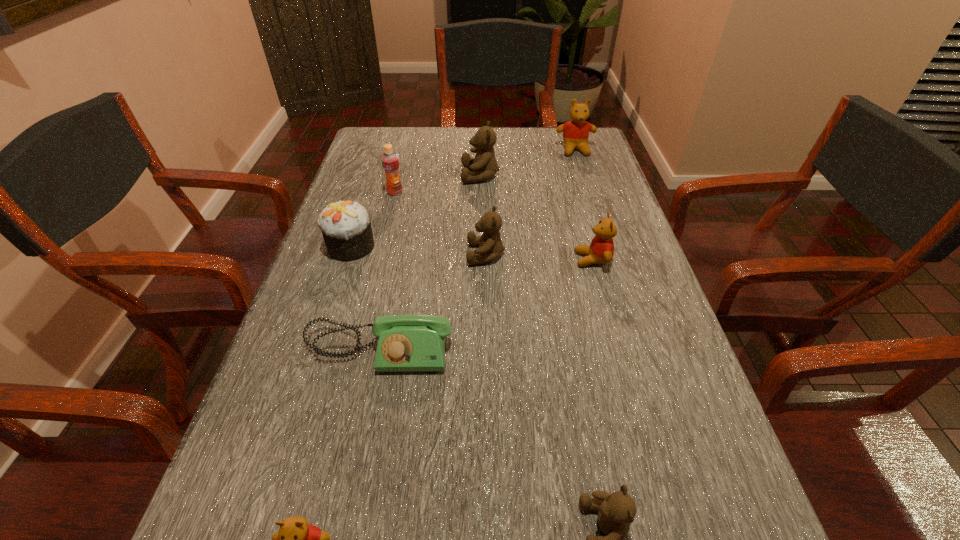
In the image, there is a desktop. Find the location of `blank space at the right edge`. blank space at the right edge is located at coordinates (597, 190).

At what (x,y) coordinates should I click in order to perform the action: click on free space at the far left corner. Please return your answer as a coordinate pair (x, y). Looking at the image, I should click on [x=356, y=157].

Find the location of `vacant space that's between the orange juice and the shortest object`. vacant space that's between the orange juice and the shortest object is located at coordinates (387, 271).

The width and height of the screenshot is (960, 540). I want to click on empty space that is in between the seventh farthest object and the cupcake, so click(x=365, y=298).

Identify which object is the closest to the second farthest teddy bear. Please provide its 2D coordinates. Your answer should be formatted as a tuple, i.e. [(x, y)], where the tuple contains the x and y coordinates of a point satisfying the conditions above.

[(390, 161)]

Choose which object is the second nearest neighbor to the farthest teddy bear. Please provide its 2D coordinates. Your answer should be formatted as a tuple, i.e. [(x, y)], where the tuple contains the x and y coordinates of a point satisfying the conditions above.

[(601, 250)]

Where is `teddy bear that is the fourth closest to the second biggest red teddy bear`? teddy bear that is the fourth closest to the second biggest red teddy bear is located at coordinates (616, 511).

Select which teddy bear appears as the closest to the leftmost teddy bear. Please provide its 2D coordinates. Your answer should be formatted as a tuple, i.e. [(x, y)], where the tuple contains the x and y coordinates of a point satisfying the conditions above.

[(616, 511)]

Find the location of `the closest brown teddy bear to the third nearest object`. the closest brown teddy bear to the third nearest object is located at coordinates (490, 245).

Identify which brown teddy bear is the second nearest to the biggest red teddy bear. Please provide its 2D coordinates. Your answer should be formatted as a tuple, i.e. [(x, y)], where the tuple contains the x and y coordinates of a point satisfying the conditions above.

[(490, 245)]